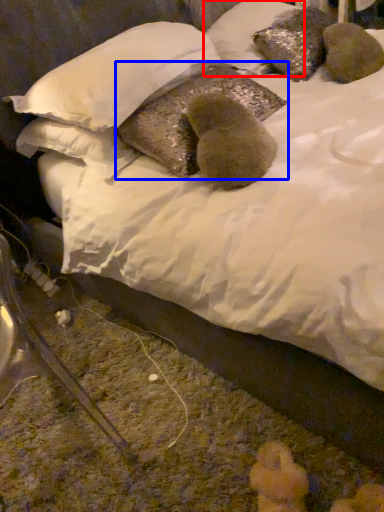
Question: Which point is closer to the camera, pillow (highlighted by a red box) or pillow (highlighted by a blue box)?

Choices:
 (A) pillow
 (B) pillow

Answer: (B)